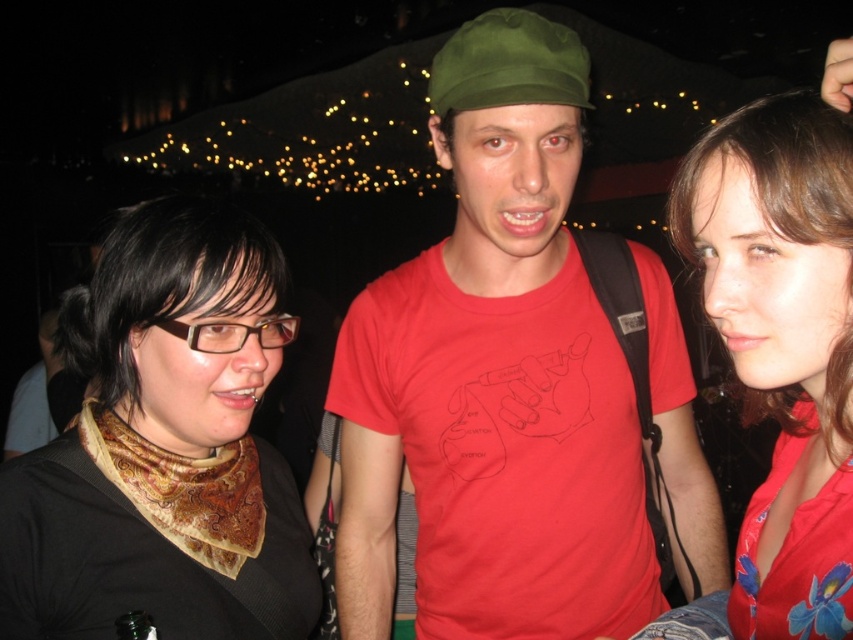
Question: Estimate the real-world distances between objects in this image. Which object is farther from the black satin scarf at left?

Choices:
 (A) matte red t-shirt at center
 (B) matte red blouse at center

Answer: (B)

Question: Does matte red t-shirt at center have a lesser width compared to matte red blouse at center?

Choices:
 (A) no
 (B) yes

Answer: (A)

Question: Among these objects, which one is farthest from the camera?

Choices:
 (A) black satin scarf at left
 (B) matte red blouse at center

Answer: (A)

Question: Is black satin scarf at left above matte red blouse at center?

Choices:
 (A) yes
 (B) no

Answer: (B)

Question: Which point is farther to the camera?

Choices:
 (A) matte red blouse at center
 (B) black satin scarf at left

Answer: (B)

Question: In this image, where is matte red t-shirt at center located relative to matte red blouse at center?

Choices:
 (A) right
 (B) left

Answer: (B)